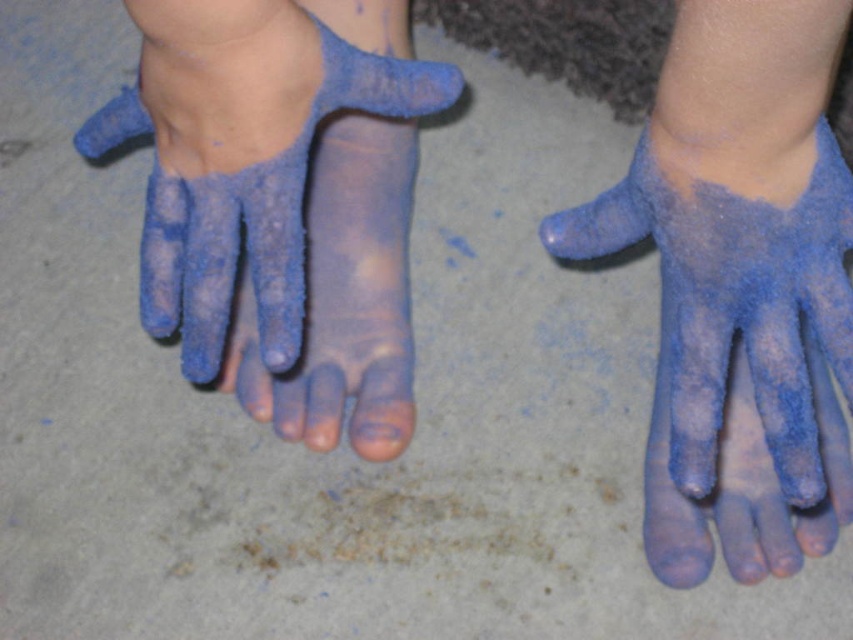
You are standing 30 inches away from a point marked at coordinates point [758,241]. Can you reach it without moving your feet?

The distance of point [758,241] from viewer is 27.75 inches. Since you are standing 30 inches away, the point is closer than your current position. You can reach it by stepping forward.

You are an artist working on a sculpture and need to place the blue powder foot at center and the blue fuzzy glove at center on a shelf. Which object should you place first if you want to arrange them from left to right as shown in the image?

You should place the blue powder foot at center first on the left side since it is positioned to the left of the blue fuzzy glove at center in the image.

You are an artist creating a sculpture and need to place the blue powder foot at center and the blue fuzzy glove at center on a display stand. The stand has a limited space. Based on their positions in the image, which object should be placed first to ensure both fit properly?

The blue powder foot at center is positioned over the blue fuzzy glove at center in the image, so you should place the blue fuzzy glove at center first on the stand to accommodate the overlapping positions.